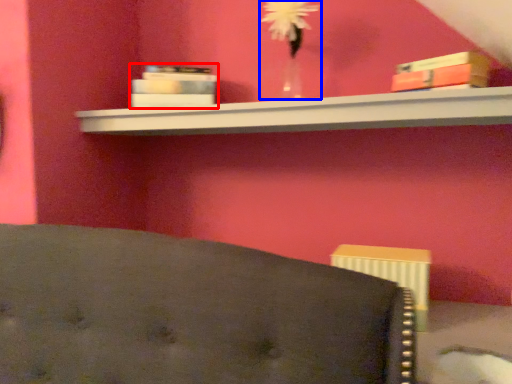
Question: Among these objects, which one is nearest to the camera, book (highlighted by a red box) or floral arrangement (highlighted by a blue box)?

Choices:
 (A) book
 (B) floral arrangement

Answer: (B)